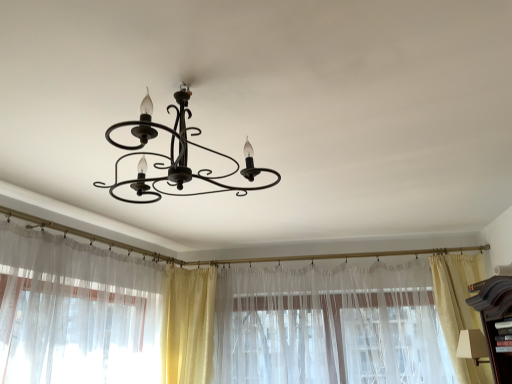
Question: Considering their positions, is beige sheer curtain at right, the fourth curtain when ordered from left to right, located in front of or behind sheer white curtain at left, arranged as the first curtain when viewed from the left?

Choices:
 (A) front
 (B) behind

Answer: (B)

Question: From the image's perspective, is beige sheer curtain at right, the fourth curtain when ordered from left to right, above or below sheer white curtain at left, the 4th curtain positioned from the right?

Choices:
 (A) above
 (B) below

Answer: (B)

Question: Which of these objects is positioned closest to the silky yellow curtain at center, which appears as the third curtain when viewed from the right?

Choices:
 (A) translucent fabric curtain at center, the third curtain in the left-to-right sequence
 (B) sheer white curtain at left, arranged as the first curtain when viewed from the left
 (C) beige sheer curtain at right, placed as the 1th curtain when sorted from right to left

Answer: (B)

Question: Considering the real-world distances, which object is closest to the beige sheer curtain at right, placed as the 1th curtain when sorted from right to left?

Choices:
 (A) translucent fabric curtain at center, the 2th curtain when ordered from right to left
 (B) silky yellow curtain at center, which is counted as the second curtain, starting from the left
 (C) sheer white curtain at left, the 4th curtain positioned from the right

Answer: (A)